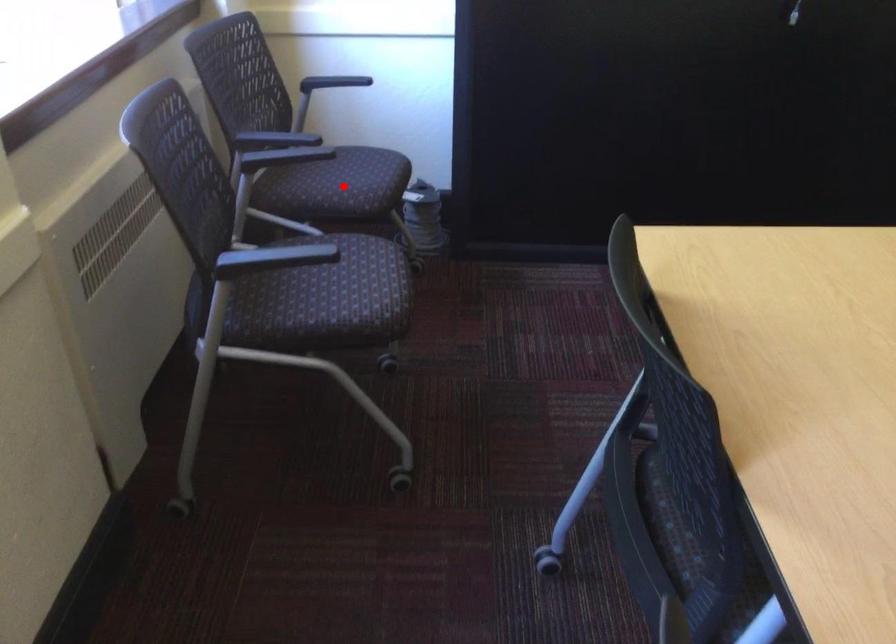
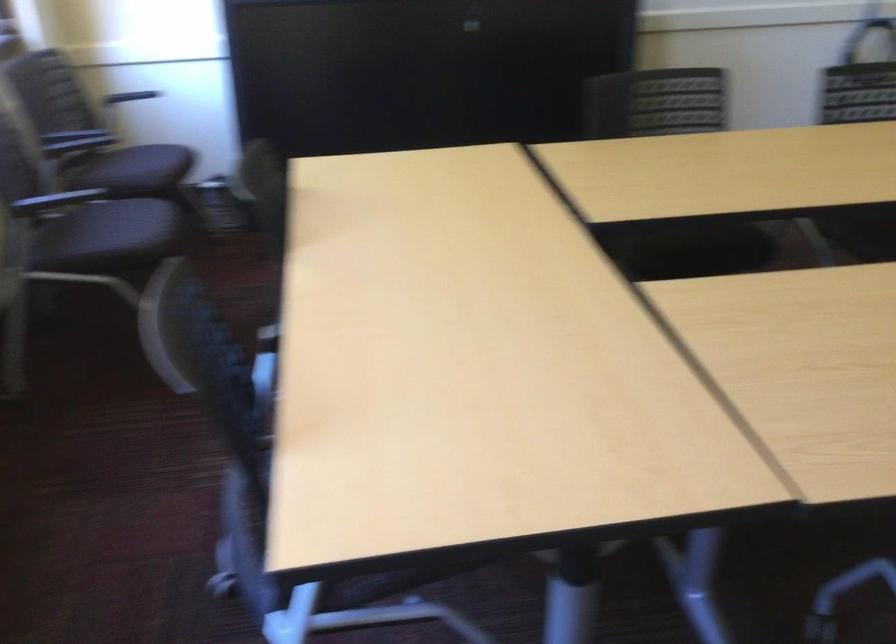
Question: I am providing you with two images of the same scene from different viewpoints. Given a red point in image1, look at the same physical point in image2. Is it:

Choices:
 (A) Closer to the viewpoint
 (B) Farther from the viewpoint

Answer: (B)